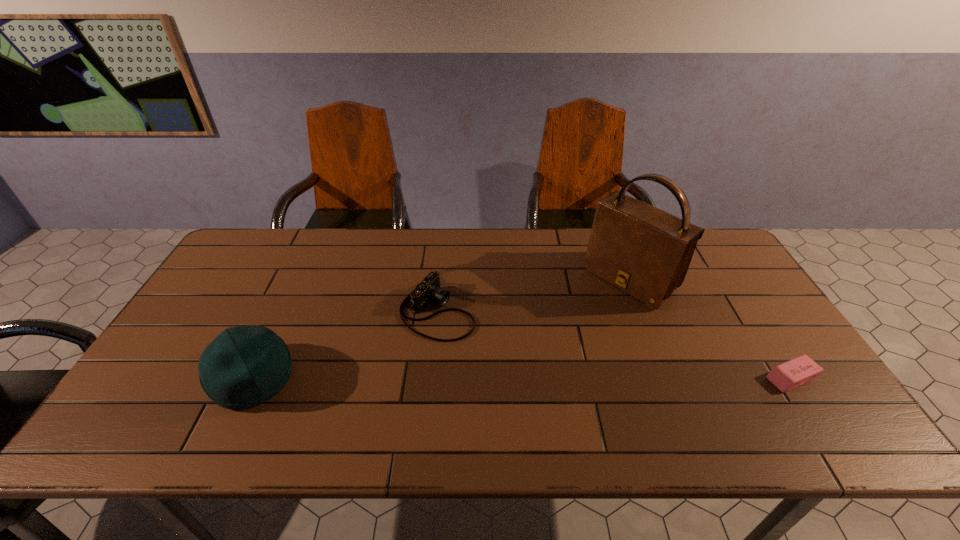
Locate an element on the screen. vacant space that satisfies the following two spatial constraints: 1. on the front side of the rightmost object; 2. on the right side of the third object from right to left is located at coordinates (431, 378).

Identify the location of vacant space that satisfies the following two spatial constraints: 1. on the back side of the leftmost object; 2. on the right side of the tallest object. The height and width of the screenshot is (540, 960). (299, 280).

The width and height of the screenshot is (960, 540). Identify the location of blank space that satisfies the following two spatial constraints: 1. on the back side of the third object from left to right; 2. on the left side of the third shortest object. (299, 280).